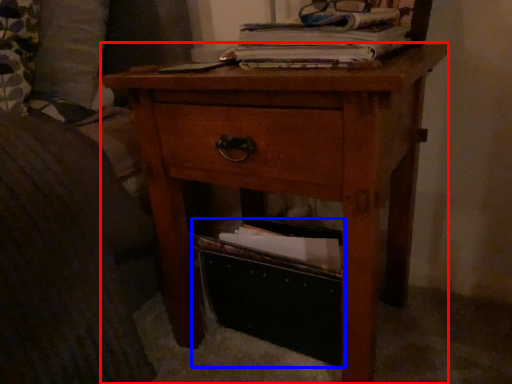
Question: Which object is further to the camera taking this photo, nightstand (highlighted by a red box) or storage box (highlighted by a blue box)?

Choices:
 (A) nightstand
 (B) storage box

Answer: (B)